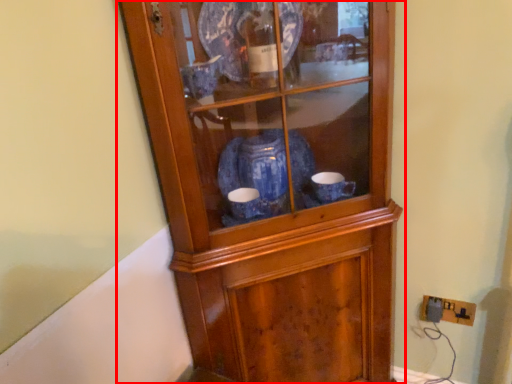
Question: From the image's perspective, where is cupboard (annotated by the red box) located relative to electric outlet?

Choices:
 (A) above
 (B) below

Answer: (A)